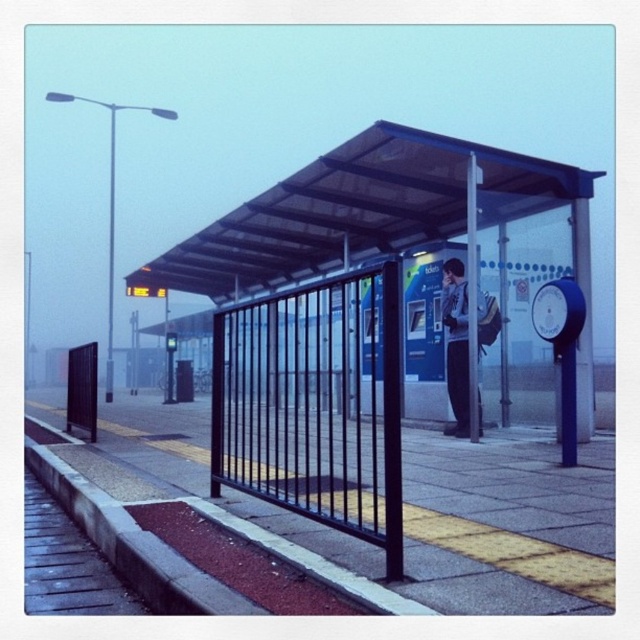
Consider the image. Can you confirm if black metal fence at center is thinner than black metal fence at left?

Incorrect, black metal fence at center's width is not less than black metal fence at left's.

Is point (257, 419) in front of point (97, 342)?

Yes, it is in front of point (97, 342).

Locate an element on the screen. The width and height of the screenshot is (640, 640). black metal fence at center is located at coordinates (316, 403).

Who is positioned more to the left, black metal fence at left or metallic gray phone box at center?

metallic gray phone box at center

Is point (67, 381) closer to camera compared to point (177, 394)?

Yes, it is in front of point (177, 394).

Where is `black metal fence at left`? black metal fence at left is located at coordinates (83, 388).

Does transparent plastic bus station at center appear over black metal fence at left?

Yes.

Is transparent plastic bus station at center thinner than black metal fence at left?

In fact, transparent plastic bus station at center might be wider than black metal fence at left.

Where is `transparent plastic bus station at center`? The width and height of the screenshot is (640, 640). transparent plastic bus station at center is located at coordinates (355, 314).

Locate an element on the screen. This screenshot has height=640, width=640. transparent plastic bus station at center is located at coordinates (355, 314).